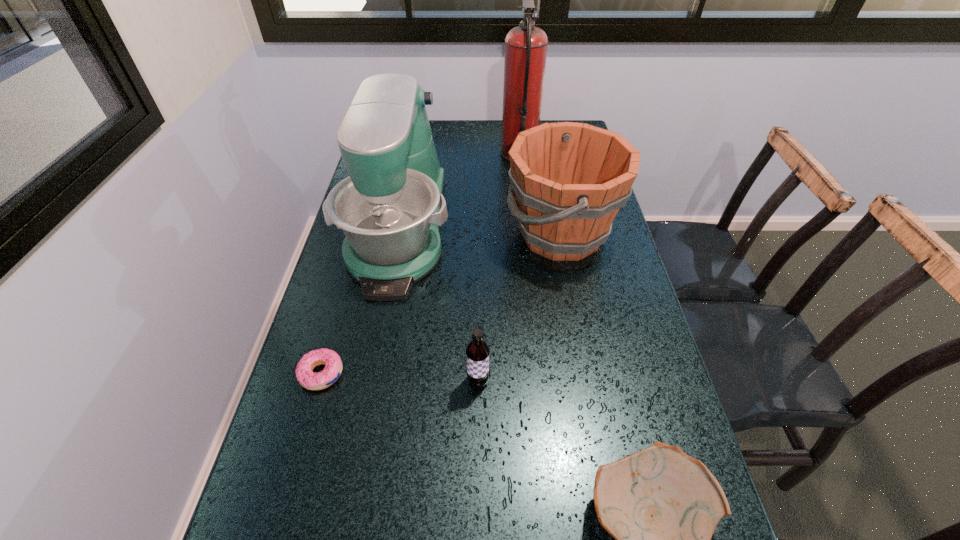
I want to click on vacant point at the far edge, so click(x=468, y=144).

I want to click on free space at the left edge, so click(x=343, y=273).

This screenshot has width=960, height=540. In order to click on free location at the right edge of the desktop in this screenshot , I will do `click(659, 395)`.

Where is `vacant region between the third object from left to right and the third tallest object`? This screenshot has height=540, width=960. vacant region between the third object from left to right and the third tallest object is located at coordinates (519, 308).

At what (x,y) coordinates should I click in order to perform the action: click on free area in between the fourth shortest object and the doughnut. Please return your answer as a coordinate pair (x, y). This screenshot has height=540, width=960. Looking at the image, I should click on (442, 304).

Image resolution: width=960 pixels, height=540 pixels. Find the location of `vacant space that's between the third object from left to right and the mixer`. vacant space that's between the third object from left to right and the mixer is located at coordinates (439, 306).

Where is `blank region between the shortest object and the fourth object from right to left`? blank region between the shortest object and the fourth object from right to left is located at coordinates (399, 377).

You are a GUI agent. You are given a task and a screenshot of the screen. Output one action in this format:
    pyautogui.click(x=<x>, y=<y>)
    Task: Click on the empty space that is in between the shortest object and the second tallest object
    
    Given the screenshot: What is the action you would take?
    click(x=360, y=301)

Point out which object is positioned as the fourth nearest to the tallest object. Please provide its 2D coordinates. Your answer should be formatted as a tuple, i.e. [(x, y)], where the tuple contains the x and y coordinates of a point satisfying the conditions above.

[(307, 378)]

Find the location of a particular element. object that can be found as the closest to the third object from left to right is located at coordinates point(390,208).